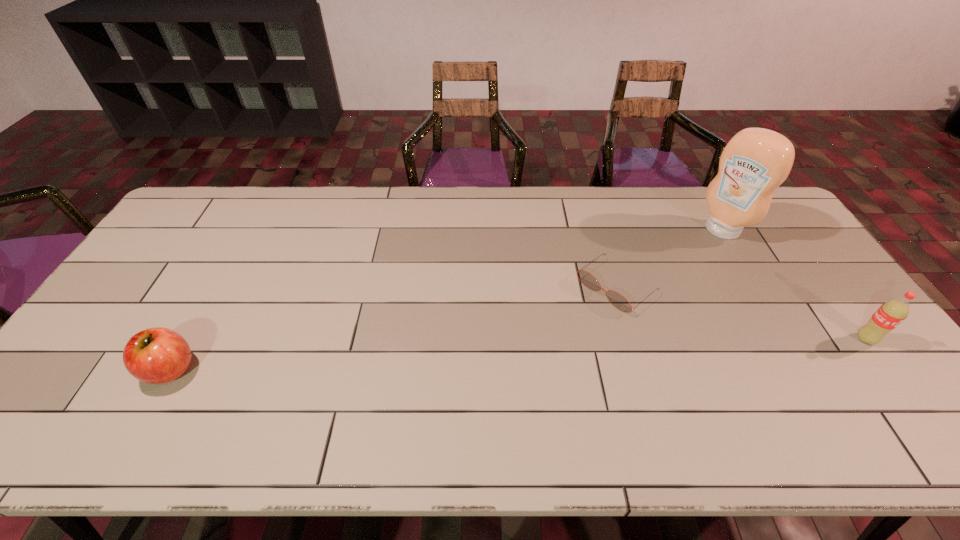
Locate an element on the screen. unoccupied position between the second tallest object and the third object from left to right is located at coordinates [x=794, y=285].

Image resolution: width=960 pixels, height=540 pixels. Identify the location of vacant region between the second farthest object and the rightmost object. (741, 313).

Image resolution: width=960 pixels, height=540 pixels. I want to click on unoccupied area between the condiment and the rightmost object, so click(x=794, y=285).

Identify the location of empty space between the second object from left to right and the tallest object. Image resolution: width=960 pixels, height=540 pixels. [669, 258].

Locate an element on the screen. This screenshot has width=960, height=540. free space between the apple and the soda is located at coordinates (518, 354).

Select which object is the second closest to the third object from left to right. Please provide its 2D coordinates. Your answer should be formatted as a tuple, i.e. [(x, y)], where the tuple contains the x and y coordinates of a point satisfying the conditions above.

[(890, 314)]

Image resolution: width=960 pixels, height=540 pixels. I want to click on object that stands as the second closest to the second shortest object, so click(x=756, y=161).

This screenshot has height=540, width=960. In order to click on free space that satisfies the following two spatial constraints: 1. on the back side of the leftmost object; 2. on the right side of the second tallest object in this screenshot , I will do `click(187, 339)`.